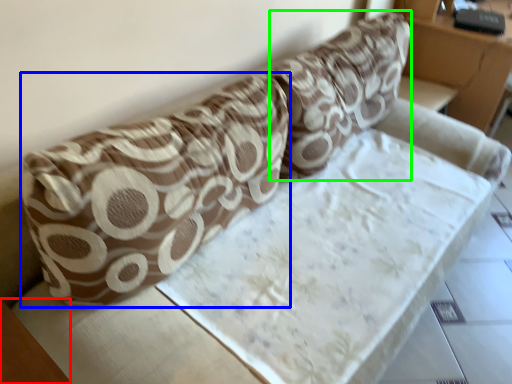
Question: Which object is the farthest from table (highlighted by a red box)? Choose among these: throw pillow (highlighted by a blue box) or throw pillow (highlighted by a green box).

Choices:
 (A) throw pillow
 (B) throw pillow

Answer: (B)